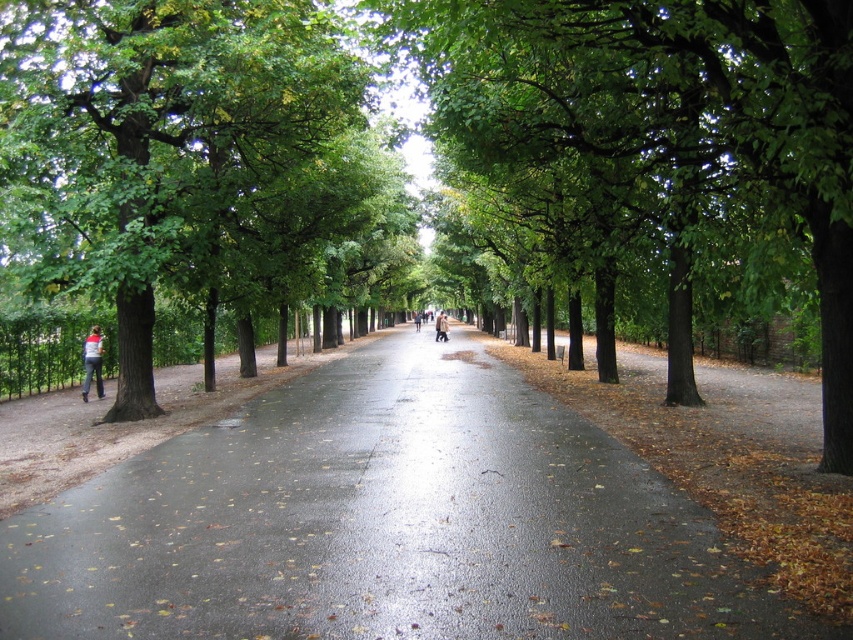
You are a delivery robot with a 1.2 meter wide package. You need to travel along the shiny asphalt road at center. Is the road wide enough for you to carry the package without going off the road?

The shiny asphalt road at center is 4.96 meters away from the viewer, but this distance refers to how far the road is, not its width. The road width cannot be determined from the given information, so it is unknown if it is wide enough for the package.

You are a photographer standing at the end of the pathway in the park. You want to capture a photo of the light brown leather coat at center and the dark blue jeans at center. Since you want both items to be clearly visible in the frame, which item should you focus on to ensure proper focus, considering their sizes?

The light brown leather coat at center has a lesser width compared to dark blue jeans at center, so you should focus on the dark blue jeans at center as it is larger and easier to capture clearly in the photo.

You are a photographer standing at the start of the pathway. You want to capture a photo of the light brown leather coat at center and dark blue jeans at center such that both are clearly visible. Given their height difference, where should you position yourself to ensure both are fully in frame?

The light brown leather coat at center is much taller than the dark blue jeans at center. To ensure both are fully visible in the photo, position yourself at a lower angle so that you can capture the taller light brown leather coat at center without cropping the top, while still including the dark blue jeans at center at the bottom of the frame.